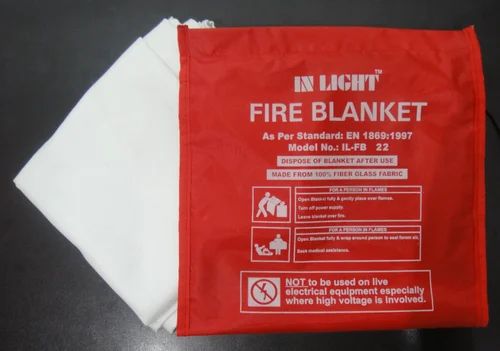
You are a GUI agent. You are given a task and a screenshot of the screen. Output one action in this format:
    pyautogui.click(x=<x>, y=<y>)
    Task: Click on the fire blanket case
    Image resolution: width=500 pixels, height=351 pixels.
    Given the screenshot: What is the action you would take?
    pyautogui.click(x=227, y=163)